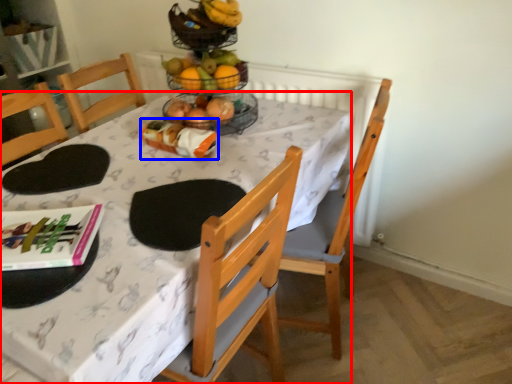
Question: Among these objects, which one is nearest to the camera, desk (highlighted by a red box) or food (highlighted by a blue box)?

Choices:
 (A) desk
 (B) food

Answer: (A)